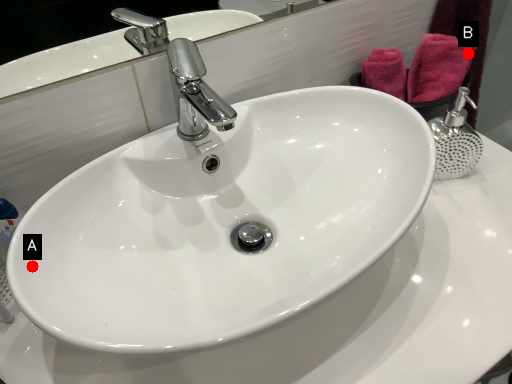
Question: Two points are circled on the image, labeled by A and B beside each circle. Which point is closer to the camera?

Choices:
 (A) A is closer
 (B) B is closer

Answer: (A)